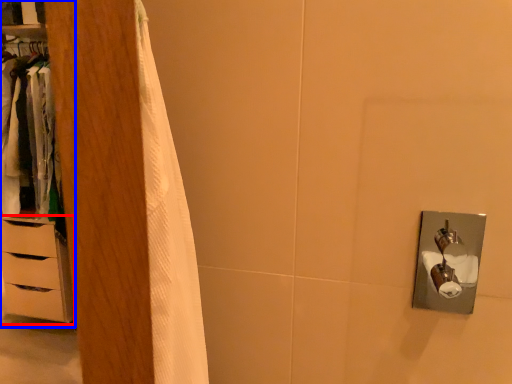
Question: Among these objects, which one is farthest to the camera, chest of drawers (highlighted by a red box) or dresser (highlighted by a blue box)?

Choices:
 (A) chest of drawers
 (B) dresser

Answer: (A)